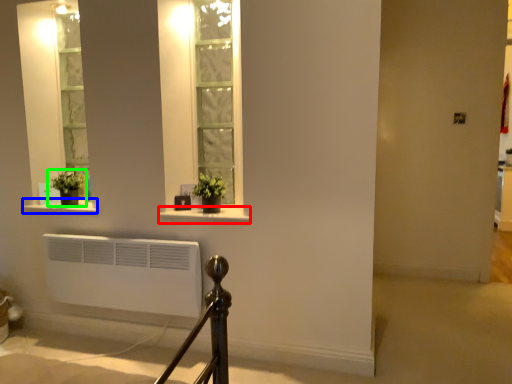
Question: Which object is positioned closest to window sill (highlighted by a red box)? Select from window sill (highlighted by a blue box) and houseplant (highlighted by a green box).

Choices:
 (A) window sill
 (B) houseplant

Answer: (A)